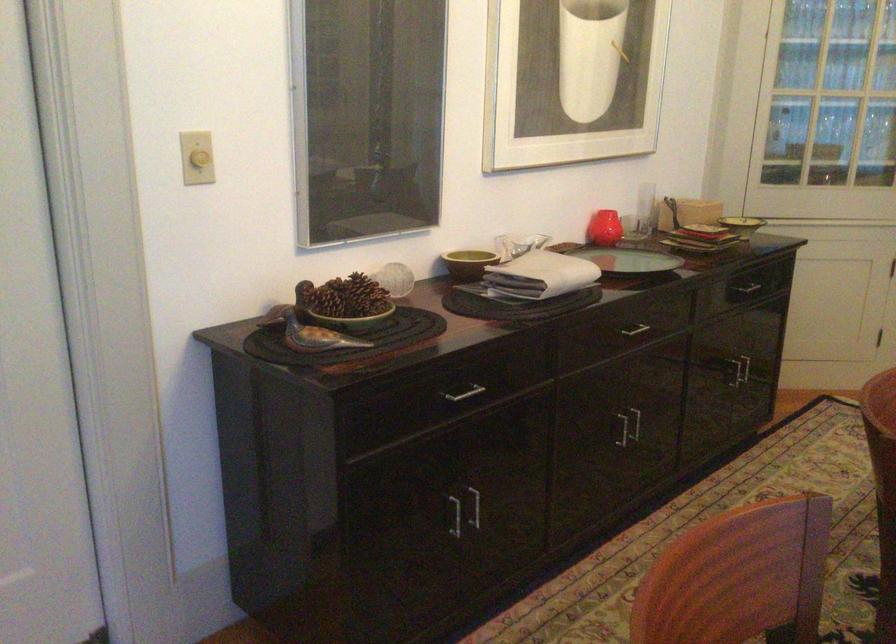
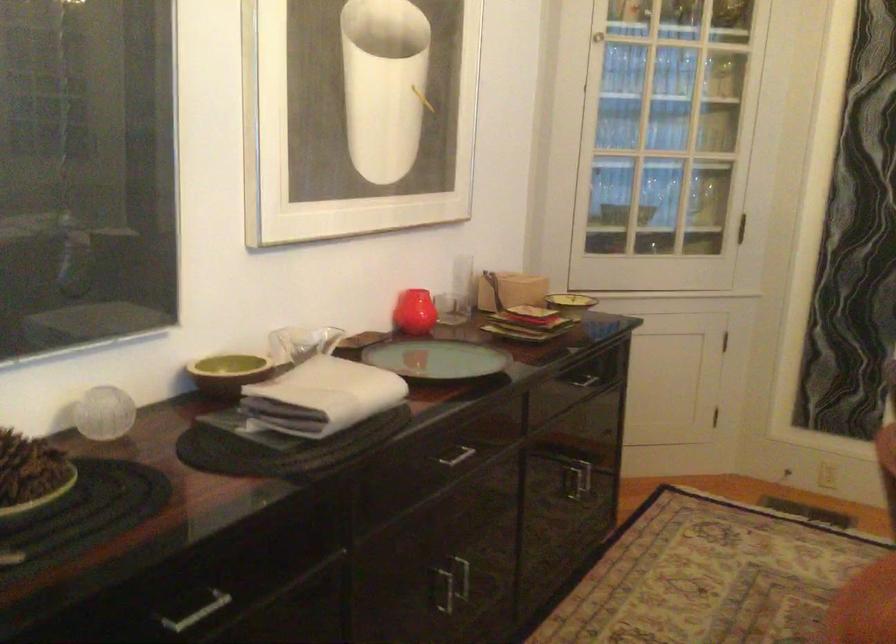
Locate, in the second image, the point that corresponds to [694,213] in the first image.

(510, 290)